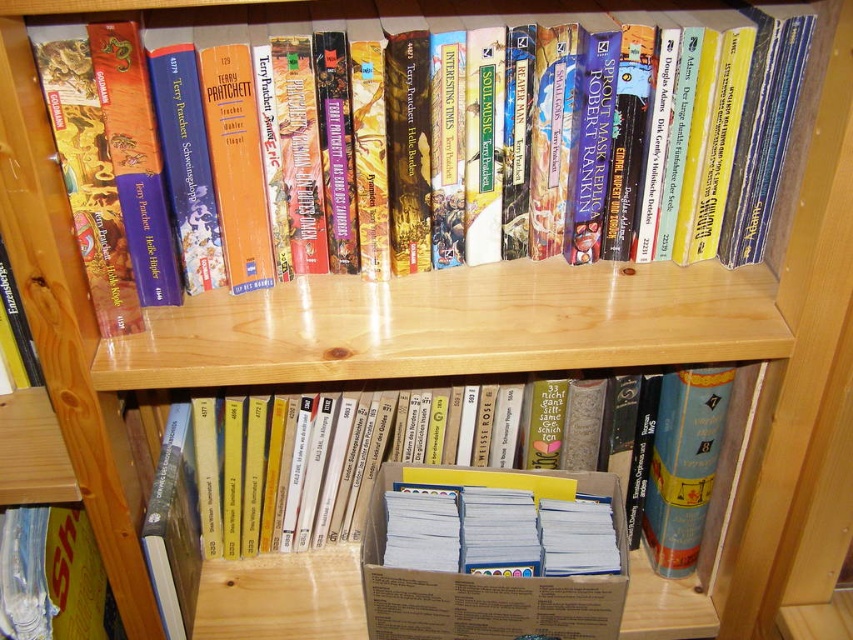
You are organizing a library and need to place the brown cardboard box at center and the hardcover book at upper center on a shelf. Considering their sizes, which one should be placed first to ensure stability?

The brown cardboard box at center has a greater height compared to the hardcover book at upper center. To ensure stability, the taller brown cardboard box at center should be placed first, followed by the shorter hardcover book at upper center on top of it.

You need to place the brown cardboard box at center and the hardcover book at upper center on a shelf that can only hold items with a combined width of 40 cm. Given their individual widths, can both items fit together on the shelf?

The brown cardboard box at center is narrower than the hardcover book at upper center. However, since their combined width is not specified, we cannot determine if they fit together on the 40 cm shelf.